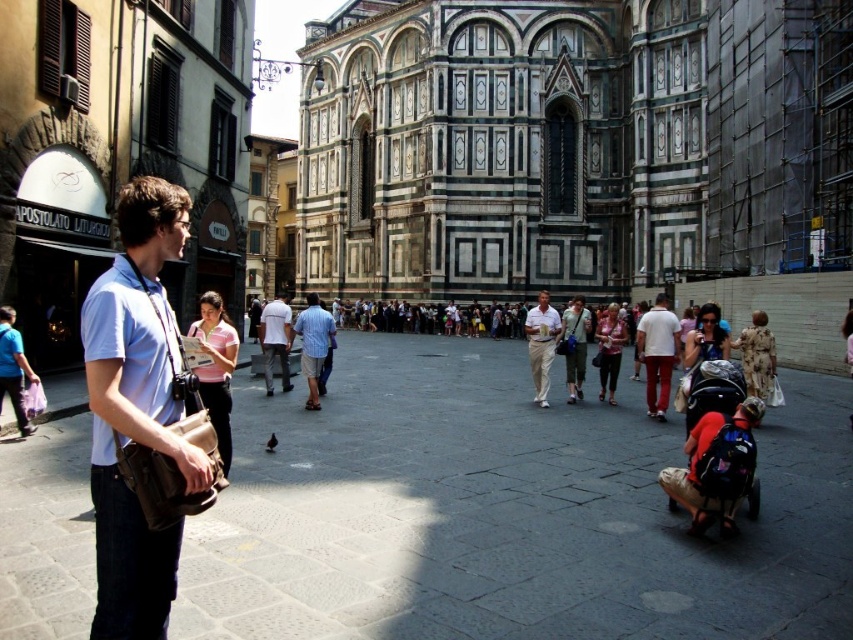
Question: Which of the following is the farthest from the observer?

Choices:
 (A) (4, 381)
 (B) (328, 324)
 (C) (216, 385)

Answer: (B)

Question: Does green canvas backpack at center appear on the right side of pink fabric purse at center?

Choices:
 (A) no
 (B) yes

Answer: (A)

Question: Among these points, which one is farthest from the camera?

Choices:
 (A) (285, 387)
 (B) (198, 321)

Answer: (A)

Question: Does light beige pants at center appear over pink fabric purse at center?

Choices:
 (A) yes
 (B) no

Answer: (A)

Question: Is matte blue shirt at left wider than white cotton shirt at center?

Choices:
 (A) no
 (B) yes

Answer: (A)

Question: Which object is the closest to the white cotton shirt at center?

Choices:
 (A) light beige pants at center
 (B) pink fabric purse at center
 (C) pink fabric shirt at center
 (D) green canvas backpack at center

Answer: (C)